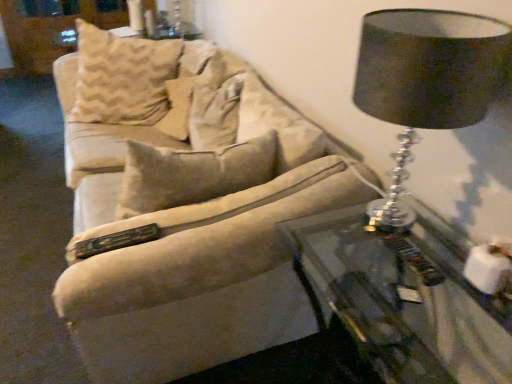
Question: Is black fabric lampshade at upper right bigger than beige fabric pillow at center?

Choices:
 (A) yes
 (B) no

Answer: (B)

Question: Is black fabric lampshade at upper right next to beige fabric pillow at center and touching it?

Choices:
 (A) yes
 (B) no

Answer: (B)

Question: Is black fabric lampshade at upper right smaller than beige fabric pillow at center?

Choices:
 (A) no
 (B) yes

Answer: (B)

Question: From the image's perspective, is black fabric lampshade at upper right on beige fabric pillow at center?

Choices:
 (A) no
 (B) yes

Answer: (A)

Question: Is the depth of black fabric lampshade at upper right greater than that of beige fabric pillow at center?

Choices:
 (A) no
 (B) yes

Answer: (A)

Question: Considering the relative sizes of black fabric lampshade at upper right and beige fabric pillow at center in the image provided, is black fabric lampshade at upper right wider than beige fabric pillow at center?

Choices:
 (A) yes
 (B) no

Answer: (B)

Question: Can you confirm if transparent glass table at lower right is bigger than beige fabric pillow at center?

Choices:
 (A) no
 (B) yes

Answer: (B)

Question: Can you confirm if transparent glass table at lower right is taller than beige fabric pillow at center?

Choices:
 (A) no
 (B) yes

Answer: (B)

Question: Does transparent glass table at lower right have a lesser height compared to beige fabric pillow at center?

Choices:
 (A) no
 (B) yes

Answer: (A)

Question: Is the depth of transparent glass table at lower right less than that of beige fabric pillow at center?

Choices:
 (A) yes
 (B) no

Answer: (A)

Question: Can you confirm if transparent glass table at lower right is smaller than beige fabric pillow at center?

Choices:
 (A) no
 (B) yes

Answer: (A)

Question: Is transparent glass table at lower right positioned with its back to beige fabric pillow at center?

Choices:
 (A) yes
 (B) no

Answer: (B)

Question: Is beige fabric pillow at center facing towards white fabric dresser at upper left?

Choices:
 (A) yes
 (B) no

Answer: (B)